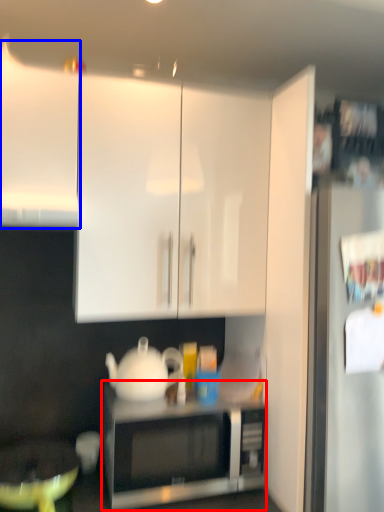
Question: Which of the following is the farthest to the observer, microwave oven (highlighted by a red box) or cabinetry (highlighted by a blue box)?

Choices:
 (A) microwave oven
 (B) cabinetry

Answer: (A)